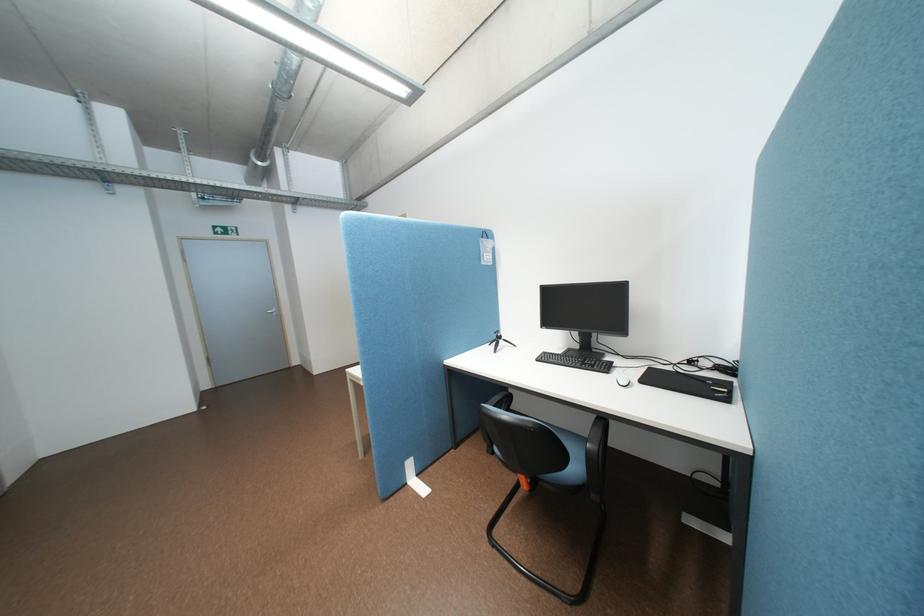
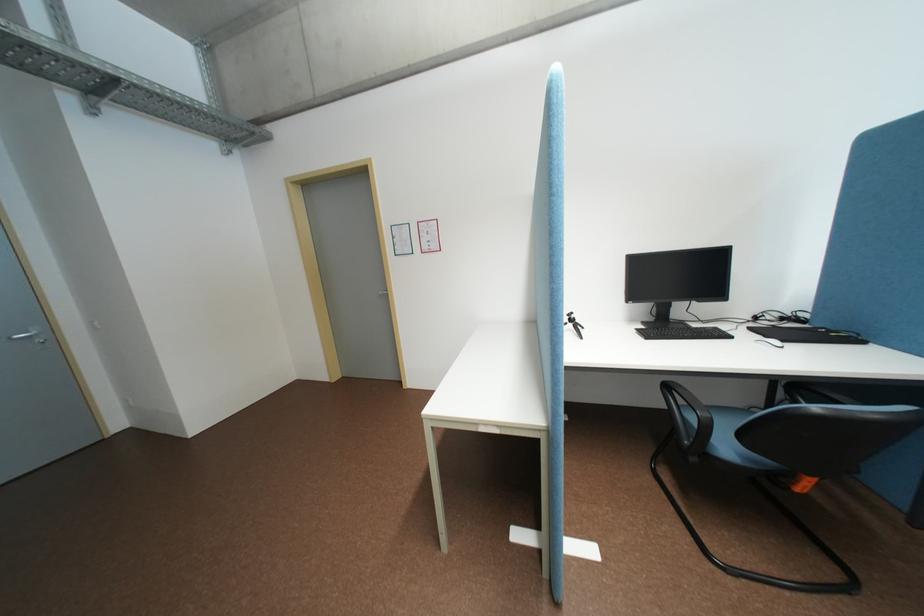
What movement of the cameraman would produce the second image?

The cameraman walked toward left, forward.